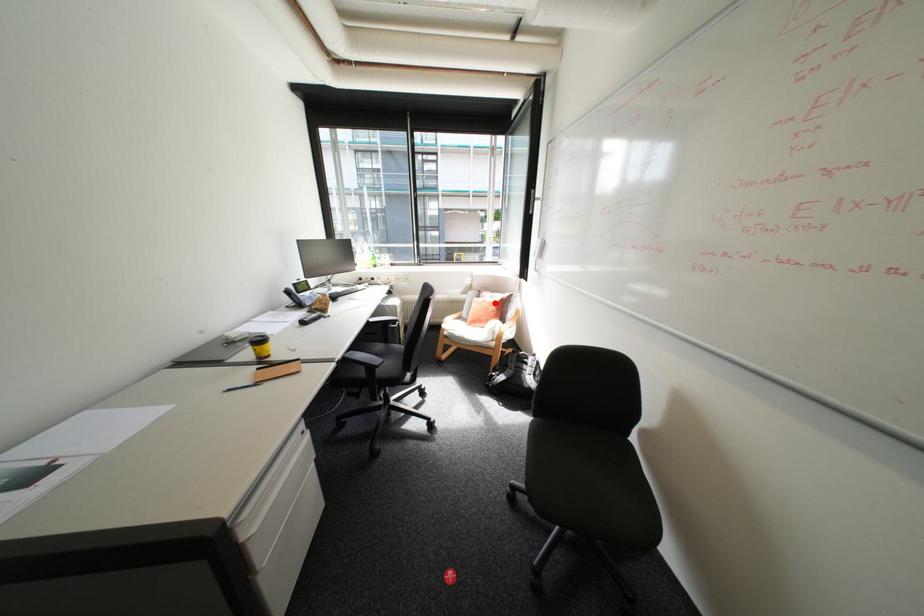
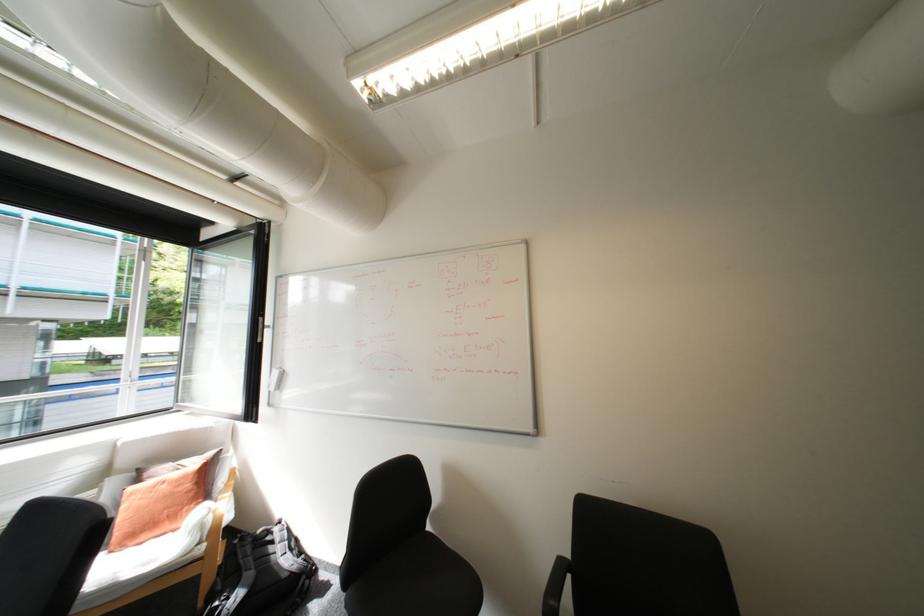
Where in the second image is the point corresponding to the highlighted location from the first image?

(175, 485)